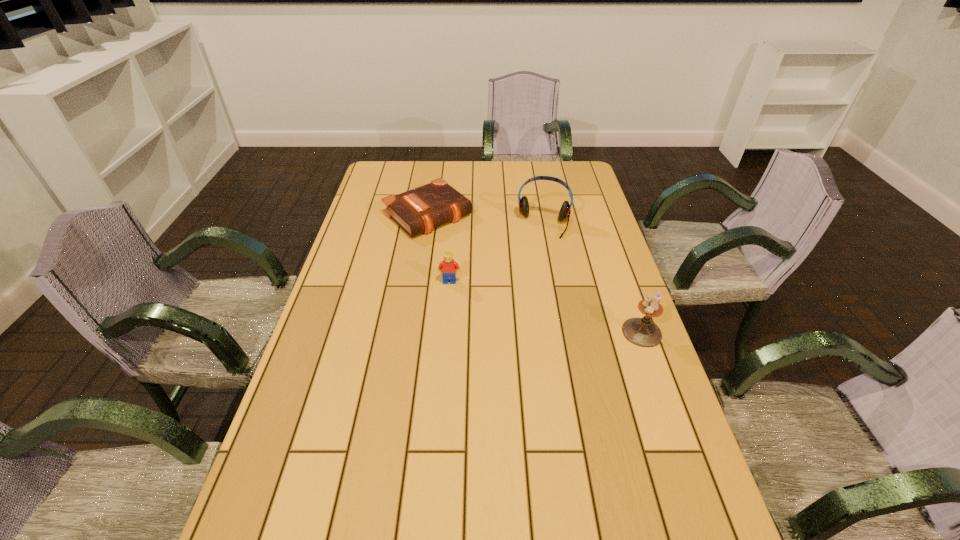
The image size is (960, 540). I want to click on the second shortest object, so click(450, 268).

Image resolution: width=960 pixels, height=540 pixels. Identify the location of Lego. (450, 268).

You are a GUI agent. You are given a task and a screenshot of the screen. Output one action in this format:
    pyautogui.click(x=<x>, y=<y>)
    Task: Click on the candle holder
    Image resolution: width=960 pixels, height=540 pixels.
    Given the screenshot: What is the action you would take?
    pyautogui.click(x=643, y=332)

This screenshot has width=960, height=540. In order to click on the nearest object in this screenshot , I will do `click(643, 332)`.

This screenshot has width=960, height=540. I want to click on headset, so click(565, 211).

Locate an element on the screen. Bible is located at coordinates (420, 210).

At what (x,y) coordinates should I click in order to perform the action: click on vacant area located 0.400m on the face of the second nearest object. Please return your answer as a coordinate pair (x, y). The width and height of the screenshot is (960, 540). Looking at the image, I should click on (441, 400).

Locate an element on the screen. This screenshot has width=960, height=540. free spot located 0.200m on the back of the rightmost object is located at coordinates (620, 271).

Where is `free space located with the microphone attached to the side of the headset`? The image size is (960, 540). free space located with the microphone attached to the side of the headset is located at coordinates (528, 305).

Locate an element on the screen. The width and height of the screenshot is (960, 540). vacant position located with the microphone attached to the side of the headset is located at coordinates (540, 248).